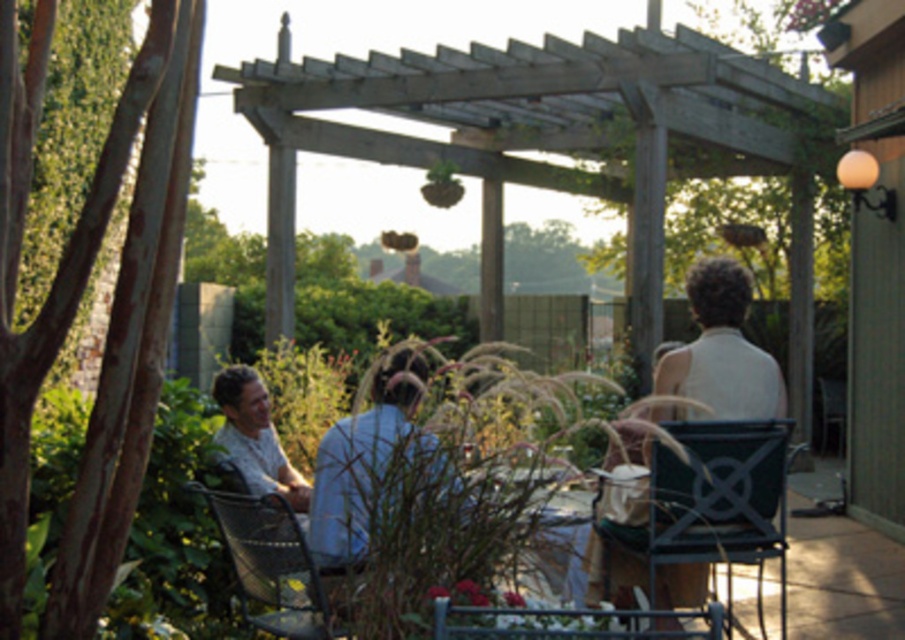
Is metallic silver chair at lower center taller than wooden table at center?

No, metallic silver chair at lower center is not taller than wooden table at center.

Is metallic silver chair at lower center to the right of wooden table at center from the viewer's perspective?

Yes, metallic silver chair at lower center is to the right of wooden table at center.

Locate an element on the screen. The width and height of the screenshot is (905, 640). metallic silver chair at lower center is located at coordinates [569, 621].

You are a GUI agent. You are given a task and a screenshot of the screen. Output one action in this format:
    pyautogui.click(x=<x>, y=<y>)
    Task: Click on the metallic silver chair at lower center
    The height and width of the screenshot is (640, 905).
    Given the screenshot: What is the action you would take?
    pyautogui.click(x=569, y=621)

Which of these two, metallic black chair at right or metallic silver chair at lower left, stands taller?

metallic black chair at right

Measure the distance from metallic black chair at right to metallic silver chair at lower left.

They are 5.88 feet apart.

Where is `metallic black chair at right`? metallic black chair at right is located at coordinates (713, 499).

What do you see at coordinates (272, 564) in the screenshot?
I see `metallic silver chair at lower left` at bounding box center [272, 564].

Is metallic silver chair at lower left further to the viewer compared to metallic silver chair at lower center?

Yes, it is.

Who is more forward, (291, 608) or (634, 625)?

Point (634, 625)

Identify the location of metallic silver chair at lower left. The width and height of the screenshot is (905, 640). (272, 564).